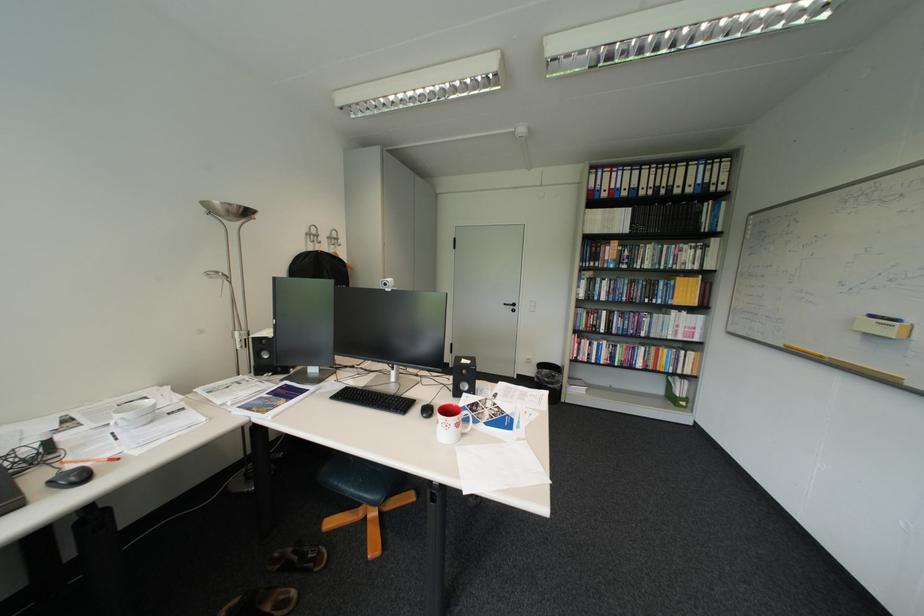
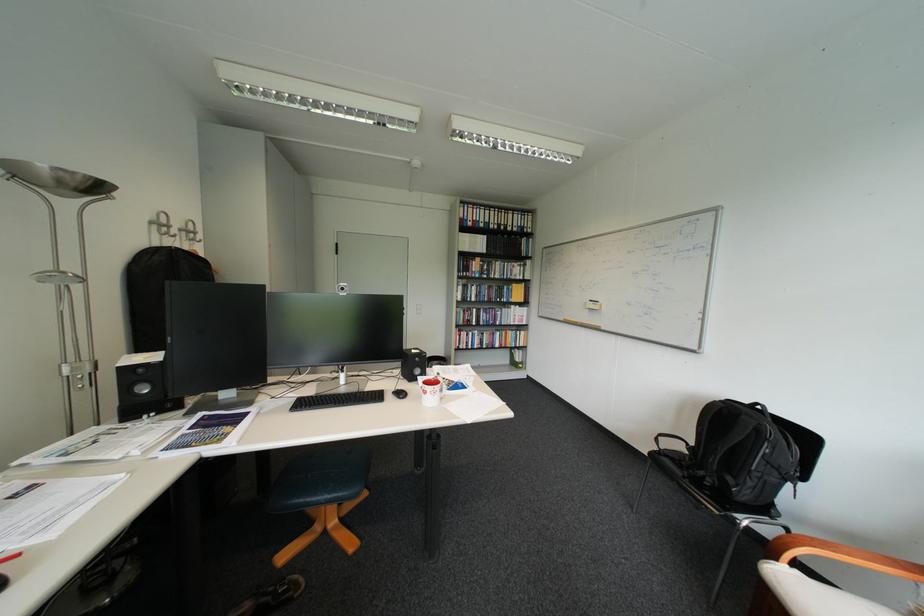
Find the pixel in the second image that matches point (317, 252) in the first image.

(160, 246)